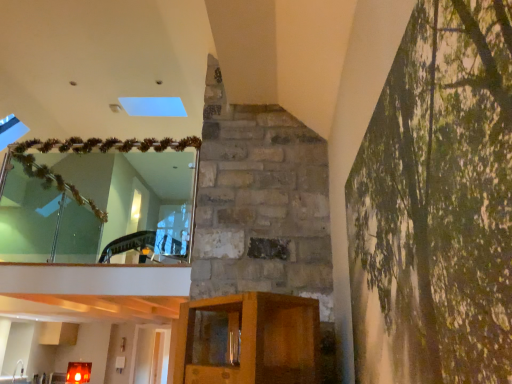
Question: In terms of height, does green textured canvas at right look taller or shorter compared to brushed metal sink at lower left?

Choices:
 (A) short
 (B) tall

Answer: (B)

Question: From a real-world perspective, is green textured canvas at right above or below brushed metal sink at lower left?

Choices:
 (A) above
 (B) below

Answer: (A)

Question: Which object is positioned closest to the brushed metal sink at lower left?

Choices:
 (A) clear glass mirror at upper left
 (B) green textured canvas at right

Answer: (A)

Question: Which is nearer to the clear glass mirror at upper left?

Choices:
 (A) green textured canvas at right
 (B) brushed metal sink at lower left

Answer: (B)